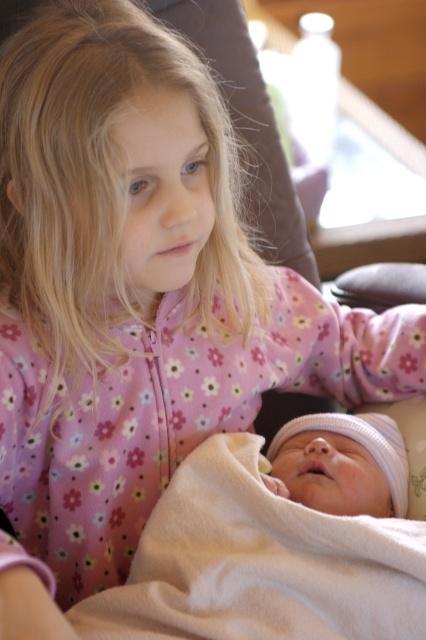
Who is taller, white fleece blanket at lower center or soft white blanket at center?

Standing taller between the two is white fleece blanket at lower center.

Who is higher up, white fleece blanket at lower center or soft white blanket at center?

Positioned higher is soft white blanket at center.

Locate an element on the screen. The height and width of the screenshot is (640, 426). white fleece blanket at lower center is located at coordinates (259, 563).